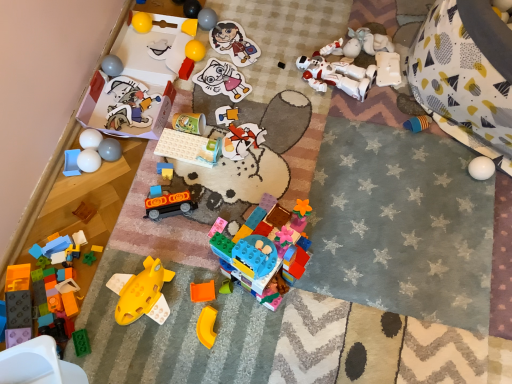
The width and height of the screenshot is (512, 384). Find the location of `vacant space in between yellow matte plastic piece at center, the seventh toy when ordered from right to left, and smooth yellow ball at upper center, the ninth toy from the right`. vacant space in between yellow matte plastic piece at center, the seventh toy when ordered from right to left, and smooth yellow ball at upper center, the ninth toy from the right is located at coordinates (206, 156).